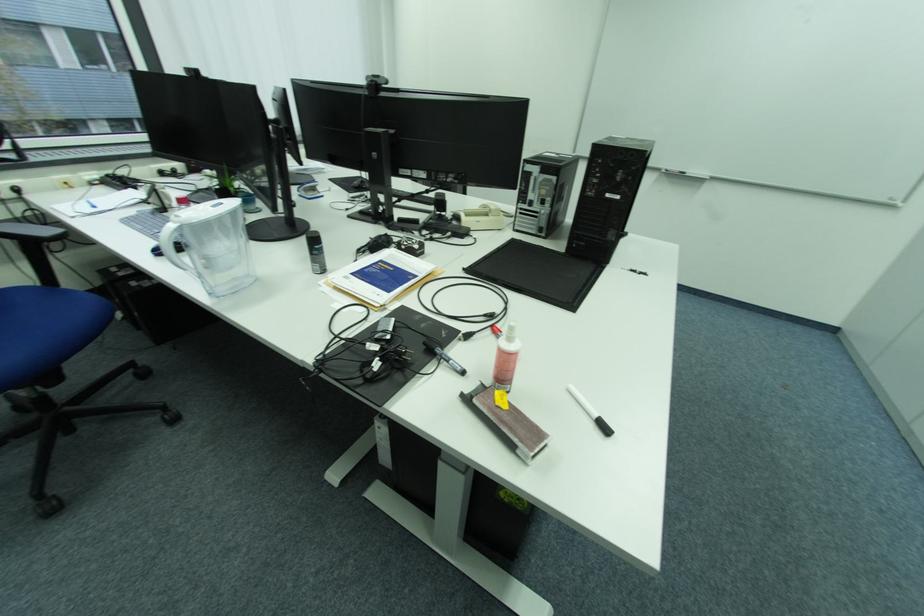
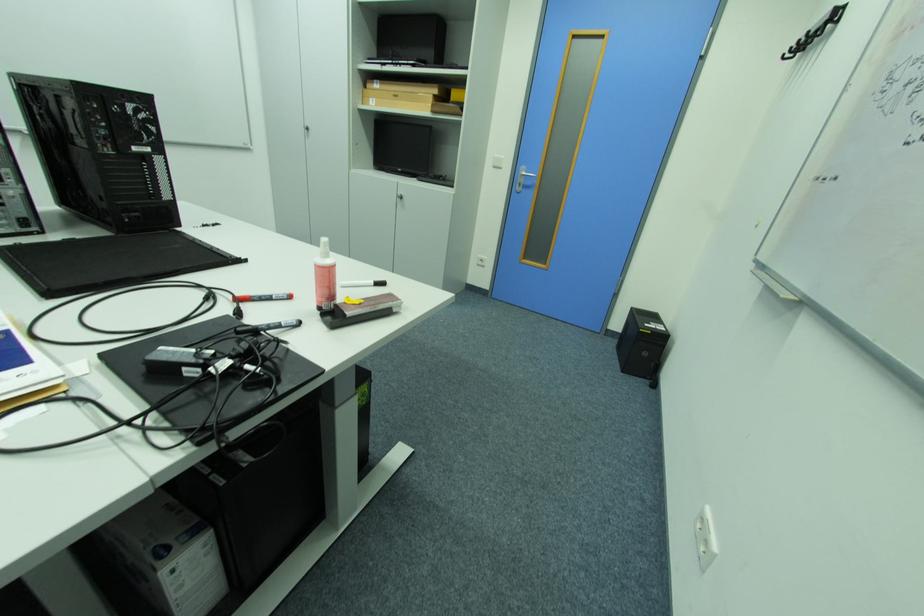
The first image is from the beginning of the video and the second image is from the end. How did the camera likely rotate when shooting the video?

The rotation direction of the camera is right-down.